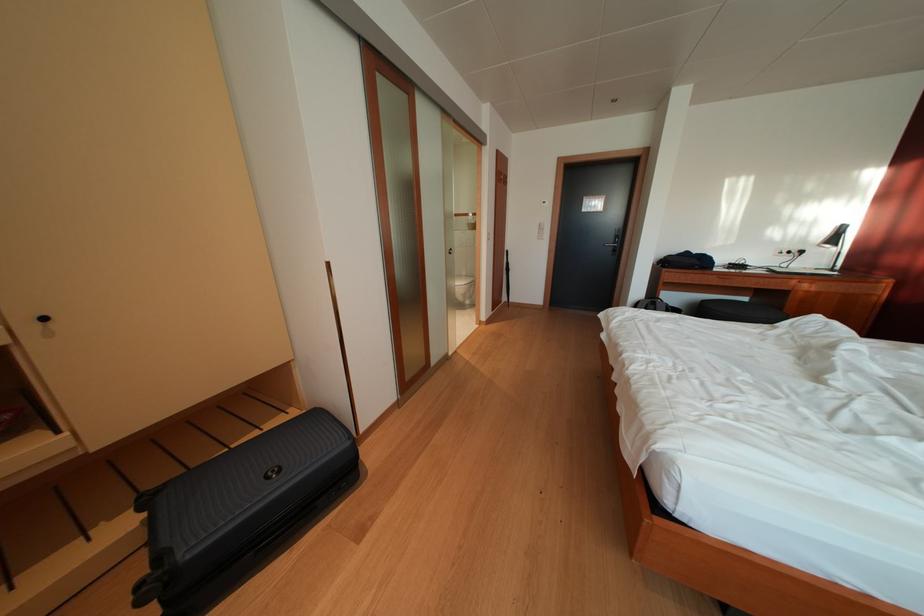
Where is `metal door handle`? This screenshot has height=616, width=924. metal door handle is located at coordinates (614, 246).